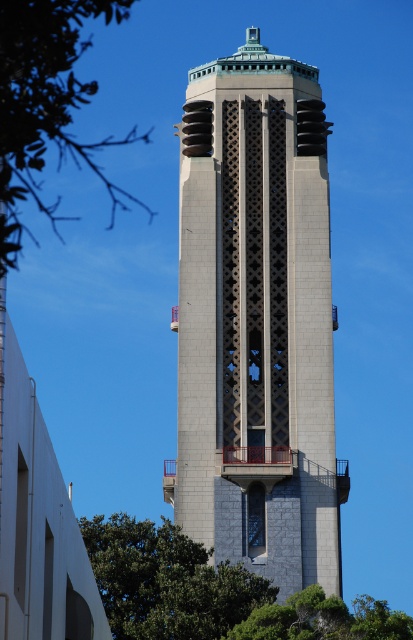
Question: Can you confirm if green leafy tree at upper left is positioned below green leafy tree at lower right?

Choices:
 (A) yes
 (B) no

Answer: (B)

Question: Which of these objects is positioned farthest from the green leafy tree at upper left?

Choices:
 (A) green leafy tree at lower right
 (B) gray stone bell tower at center

Answer: (B)

Question: Does green leafy tree at upper left appear on the right side of green leafy tree at lower right?

Choices:
 (A) yes
 (B) no

Answer: (B)

Question: Does green leafy tree at upper left have a larger size compared to green leafy tree at lower center?

Choices:
 (A) no
 (B) yes

Answer: (B)

Question: Which object is farther from the camera taking this photo?

Choices:
 (A) green leafy tree at upper left
 (B) green leafy tree at lower center

Answer: (B)

Question: Which of the following is the closest to the observer?

Choices:
 (A) green leafy tree at upper left
 (B) gray stone bell tower at center

Answer: (A)